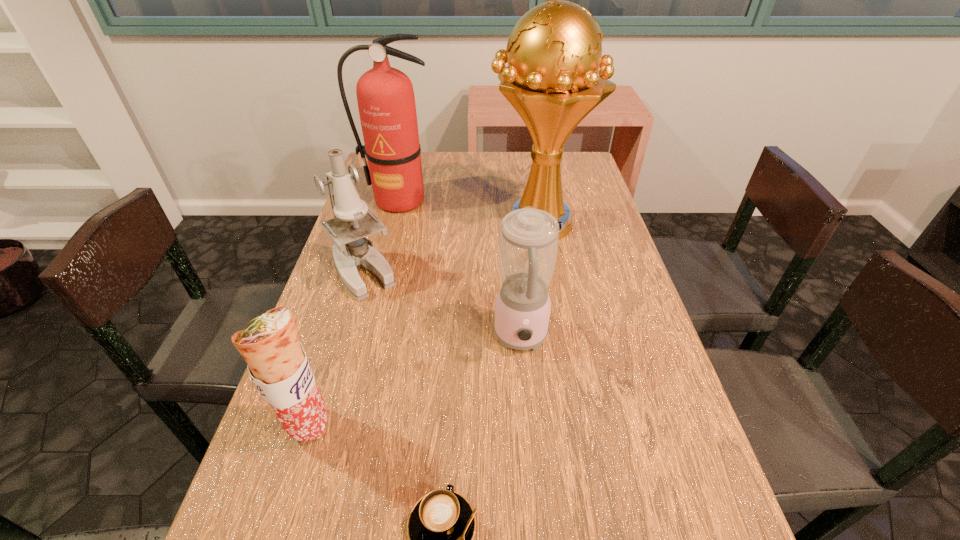
Locate an element on the screen. Image resolution: width=960 pixels, height=540 pixels. trophy_cup is located at coordinates (x=554, y=52).

The height and width of the screenshot is (540, 960). Identify the location of the fifth shortest object. (385, 96).

Where is `microscope`? microscope is located at coordinates (353, 221).

Locate an element on the screen. This screenshot has height=540, width=960. the third nearest object is located at coordinates (528, 244).

Find the location of a particular element. Image resolution: width=960 pixels, height=540 pixels. the second nearest object is located at coordinates (277, 363).

Locate an element on the screen. This screenshot has height=540, width=960. vacant space situated at the front of the trophy_cup where the globe is prominent is located at coordinates (451, 222).

Where is `vacant position located at the front of the trophy_cup where the globe is prominent`? The image size is (960, 540). vacant position located at the front of the trophy_cup where the globe is prominent is located at coordinates (468, 222).

Where is `free space located 0.330m at the front of the trophy_cup where the globe is prominent`? This screenshot has height=540, width=960. free space located 0.330m at the front of the trophy_cup where the globe is prominent is located at coordinates (377, 222).

Find the location of a particular element. free space located 0.200m on the side of the second tallest object with the nozzle and handle is located at coordinates (384, 256).

Locate an element on the screen. free location located 0.350m on the back of the microscope is located at coordinates (390, 183).